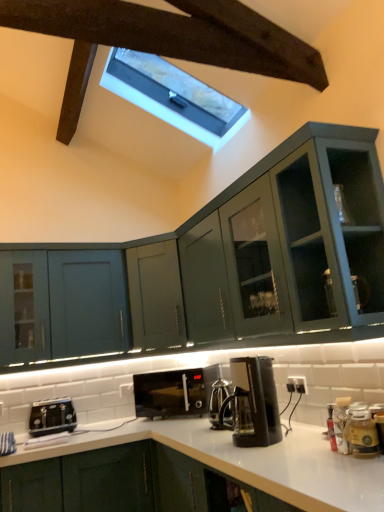
Question: Choose the correct answer: Is black plastic coffee maker at center inside black plastic toaster at lower left or outside it?

Choices:
 (A) outside
 (B) inside

Answer: (A)

Question: From a real-world perspective, is black plastic coffee maker at center above or below black plastic toaster at lower left?

Choices:
 (A) below
 (B) above

Answer: (B)

Question: Considering the real-world distances, which object is closest to the matte green cabinet at left, the 2th cabinetry positioned from the bottom?

Choices:
 (A) black plastic coffee maker at center
 (B) black matte microwave at center
 (C) translucent glass jar at lower right
 (D) white marble window at upper center
 (E) black plastic toaster at lower left

Answer: (E)

Question: Which object is positioned farthest from the matte green cabinet at left, which appears as the first cabinetry when viewed from the top?

Choices:
 (A) translucent glass jar at lower right
 (B) black plastic coffee maker at center
 (C) white marble window at upper center
 (D) black plastic toaster at lower left
 (E) black matte toaster at lower left, the second cabinetry from the top

Answer: (A)